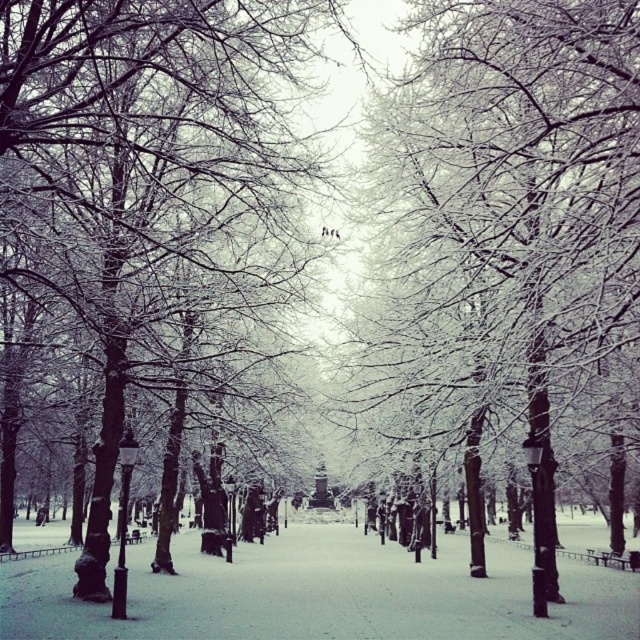
Between point (634, 276) and point (141, 70), which one is positioned behind?

The point (141, 70) is more distant.

From the picture: Is white frosty branches at center to the left of white frosty tree at center from the viewer's perspective?

In fact, white frosty branches at center is to the right of white frosty tree at center.

Looking at this image, measure the distance between point (554, 225) and camera.

47.90 feet

This screenshot has height=640, width=640. I want to click on white frosty branches at center, so click(x=508, y=214).